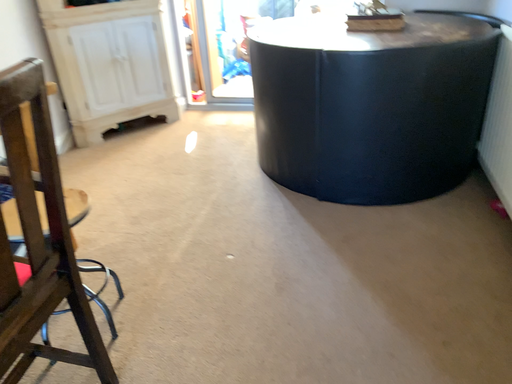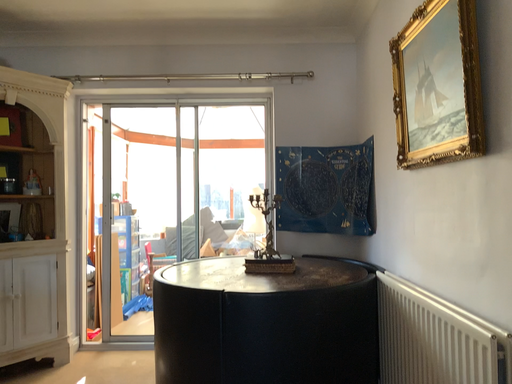
Question: How did the camera likely rotate when shooting the video?

Choices:
 (A) rotated downward
 (B) rotated upward

Answer: (B)